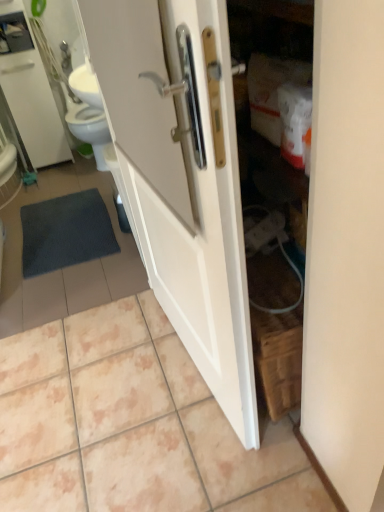
Locate an element on the screen. white glossy tile at center is located at coordinates (131, 424).

What is the approximate height of white glossy medicine cabinet at upper left?

It is 3.45 feet.

What do you see at coordinates (65, 232) in the screenshot? I see `dark gray textured bath mat at lower left` at bounding box center [65, 232].

Find the location of a particular element. The image size is (384, 512). white glossy tile at center is located at coordinates (131, 424).

Would you say white glossy tile at center is inside or outside white glossy medicine cabinet at upper left?

white glossy tile at center cannot be found inside white glossy medicine cabinet at upper left.

Is white glossy tile at center wider than white glossy medicine cabinet at upper left?

Indeed, white glossy tile at center has a greater width compared to white glossy medicine cabinet at upper left.

From a real-world perspective, between white glossy tile at center and white glossy medicine cabinet at upper left, who is vertically higher?

white glossy medicine cabinet at upper left, from a real-world perspective.

Which of these two, white glossy tile at center or white glossy medicine cabinet at upper left, stands taller?

Standing taller between the two is white glossy medicine cabinet at upper left.

Is white glossy tile at center at the right side of white glossy door at center?

No, white glossy tile at center is not to the right of white glossy door at center.

Consider the image. Could you tell me if white glossy tile at center is facing white glossy door at center?

No, white glossy tile at center does not turn towards white glossy door at center.

From the image's perspective, is white glossy tile at center over white glossy door at center?

No.

Considering the relative sizes of white glossy tile at center and white glossy door at center in the image provided, is white glossy tile at center shorter than white glossy door at center?

Correct, white glossy tile at center is not as tall as white glossy door at center.

From the image's perspective, which is below, white glossy door at center or white glossy tile at center?

From the image's view, white glossy tile at center is below.

From a real-world perspective, is white glossy door at center located beneath white glossy tile at center?

No, from a real-world perspective, white glossy door at center is not beneath white glossy tile at center.

Does point (153, 230) come in front of point (180, 346)?

Yes.

Which is in front, point (175, 246) or point (48, 111)?

Point (175, 246)

Can you confirm if white glossy door at center is smaller than white glossy medicine cabinet at upper left?

Incorrect, white glossy door at center is not smaller in size than white glossy medicine cabinet at upper left.

Looking at this image, is white glossy door at center looking in the opposite direction of white glossy medicine cabinet at upper left?

No, white glossy medicine cabinet at upper left is not at the back of white glossy door at center.

From the image's perspective, which one is positioned lower, white glossy door at center or white glossy medicine cabinet at upper left?

white glossy door at center is shown below in the image.

Could you tell me if white glossy door at center is turned towards dark gray textured bath mat at lower left?

No.

Which point is more forward, [107,27] or [24,253]?

Positioned in front is point [107,27].

Consider the image. From a real-world perspective, between white glossy door at center and dark gray textured bath mat at lower left, who is vertically higher?

white glossy door at center.

Is white glossy door at center inside white glossy medicine cabinet at upper left?

No, white glossy door at center is located outside of white glossy medicine cabinet at upper left.

From the picture: Is white glossy medicine cabinet at upper left taller than white glossy door at center?

No, white glossy medicine cabinet at upper left is not taller than white glossy door at center.

From a real-world perspective, who is located higher, white glossy medicine cabinet at upper left or white glossy door at center?

From a 3D spatial view, white glossy door at center is above.

Where is `bath mat below the white glossy medicine cabinet at upper left (from the image's perspective)`? bath mat below the white glossy medicine cabinet at upper left (from the image's perspective) is located at coordinates (65, 232).

Between dark gray textured bath mat at lower left and white glossy medicine cabinet at upper left, which one has less height?

With less height is dark gray textured bath mat at lower left.

From a real-world perspective, is dark gray textured bath mat at lower left physically located above or below white glossy medicine cabinet at upper left?

In terms of real-world spatial position, dark gray textured bath mat at lower left is below white glossy medicine cabinet at upper left.

How different are the orientations of dark gray textured bath mat at lower left and white glossy medicine cabinet at upper left in degrees?

The facing directions of dark gray textured bath mat at lower left and white glossy medicine cabinet at upper left are 91.5 degrees apart.

The image size is (384, 512). What are the coordinates of `ceramic tile that appears below the white glossy medicine cabinet at upper left (from the image's perspective)` in the screenshot? It's located at (131, 424).

The height and width of the screenshot is (512, 384). I want to click on door that is on the right side of white glossy tile at center, so click(182, 176).

From the image, which object appears to be farther from white glossy tile at center, dark gray textured bath mat at lower left or white glossy medicine cabinet at upper left?

Among the two, white glossy medicine cabinet at upper left is located further to white glossy tile at center.

Considering their positions, is white glossy medicine cabinet at upper left positioned closer to white glossy tile at center than white glossy door at center?

The object closer to white glossy tile at center is white glossy door at center.

Based on their spatial positions, is white glossy door at center or white glossy tile at center closer to dark gray textured bath mat at lower left?

Based on the image, white glossy tile at center appears to be nearer to dark gray textured bath mat at lower left.

Based on their spatial positions, is white glossy tile at center or white glossy medicine cabinet at upper left further from white glossy door at center?

white glossy medicine cabinet at upper left is further to white glossy door at center.

Estimate the real-world distances between objects in this image. Which object is further from dark gray textured bath mat at lower left, white glossy door at center or white glossy medicine cabinet at upper left?

white glossy door at center lies further to dark gray textured bath mat at lower left than the other object.

Which object lies nearer to the anchor point white glossy medicine cabinet at upper left, white glossy door at center or white glossy tile at center?

white glossy door at center is positioned closer to the anchor white glossy medicine cabinet at upper left.

Which object lies further to the anchor point white glossy door at center, white glossy medicine cabinet at upper left or white glossy tile at center?

Among the two, white glossy medicine cabinet at upper left is located further to white glossy door at center.

Looking at the image, which one is located further to white glossy door at center, white glossy medicine cabinet at upper left or dark gray textured bath mat at lower left?

white glossy medicine cabinet at upper left.

What are the coordinates of `bath mat between white glossy tile at center and white glossy medicine cabinet at upper left along the z-axis` in the screenshot? It's located at (65, 232).

The height and width of the screenshot is (512, 384). Find the location of `ceramic tile between white glossy door at center and dark gray textured bath mat at lower left along the z-axis`. ceramic tile between white glossy door at center and dark gray textured bath mat at lower left along the z-axis is located at coordinates tap(131, 424).

I want to click on bath mat positioned between white glossy door at center and white glossy medicine cabinet at upper left from near to far, so click(65, 232).

Where is `ceramic tile between white glossy door at center and white glossy medicine cabinet at upper left in the front-back direction`? ceramic tile between white glossy door at center and white glossy medicine cabinet at upper left in the front-back direction is located at coordinates (131, 424).